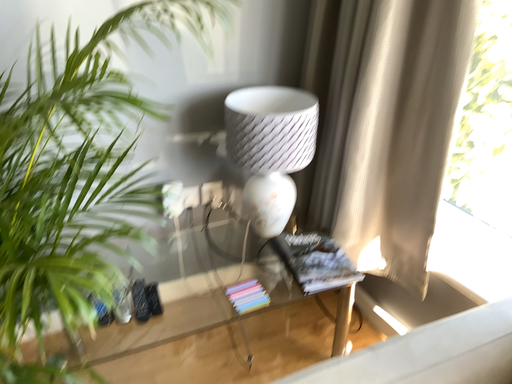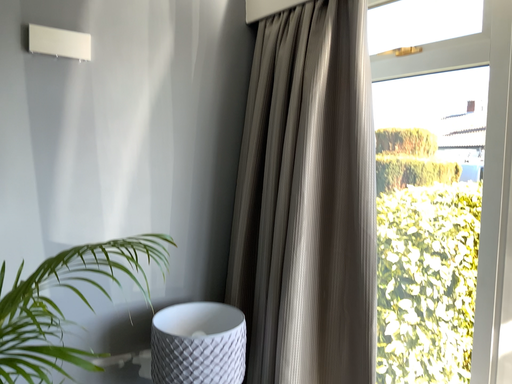
Question: Which way did the camera rotate in the video?

Choices:
 (A) rotated upward
 (B) rotated downward

Answer: (A)